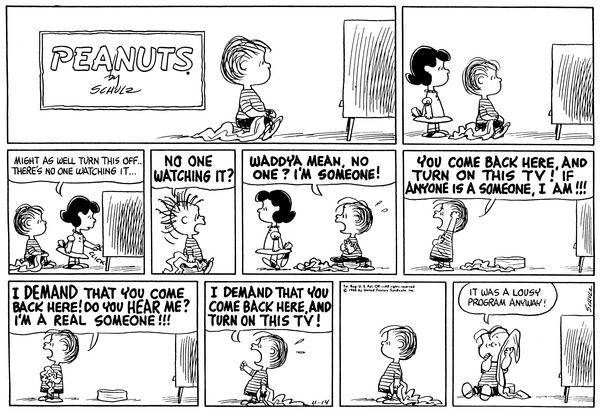
At what (x,y) coordinates should I click in order to perform the action: click on blankets. Please return your answer as a coordinate pair (x, y). This screenshot has width=600, height=411. Looking at the image, I should click on (44, 380), (281, 394), (425, 396), (506, 390), (479, 267), (320, 265), (172, 264), (32, 265), (252, 134), (465, 131).